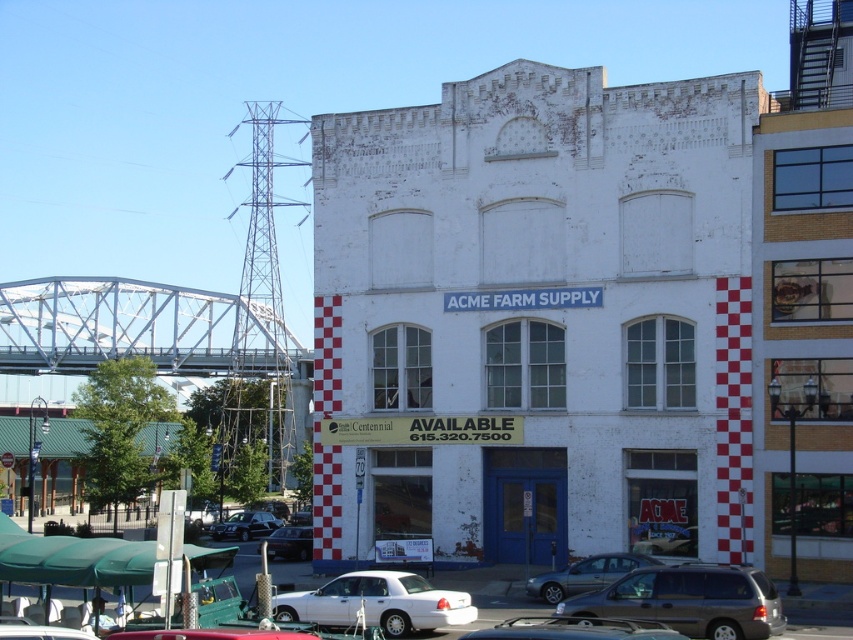
Question: Which object appears closest to the camera in this image?

Choices:
 (A) metallic gray minivan at center
 (B) white matte sedan at center
 (C) shiny black sedan at lower left
 (D) white brick building at center

Answer: (B)

Question: Can you confirm if silver metallic sedan at lower center is positioned below matte black car at lower left?

Choices:
 (A) no
 (B) yes

Answer: (A)

Question: Is shiny black sedan at lower left to the left of matte black car at lower left from the viewer's perspective?

Choices:
 (A) no
 (B) yes

Answer: (B)

Question: Is white brick building at center thinner than metallic gray minivan at center?

Choices:
 (A) no
 (B) yes

Answer: (A)

Question: Which object is farther from the camera taking this photo?

Choices:
 (A) white matte sedan at center
 (B) white matte sedan at lower center
 (C) shiny black sedan at lower left

Answer: (C)

Question: Which of the following is the farthest from the observer?

Choices:
 (A) (735, 588)
 (B) (584, 566)

Answer: (B)